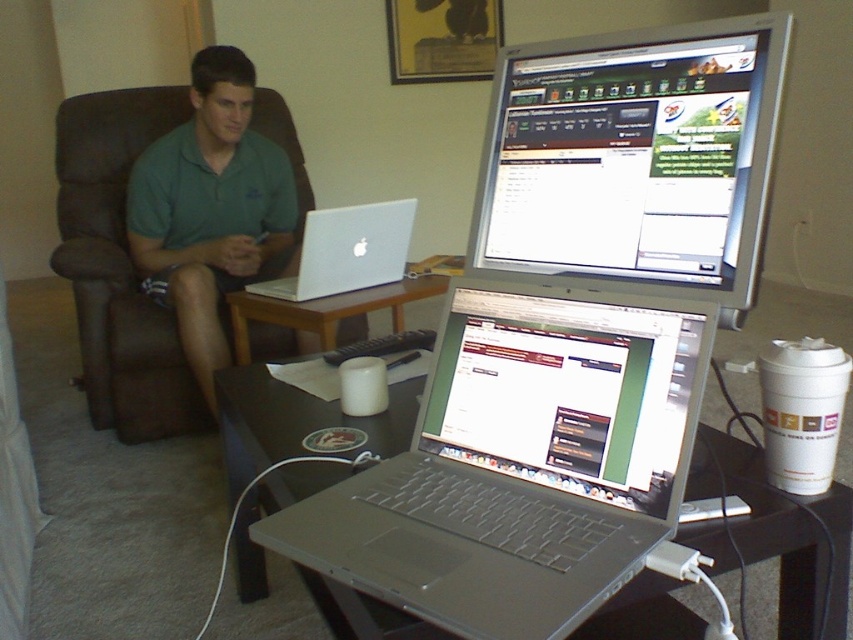
You are a delivery person who needs to place a package on the black glossy table at lower center. However, there is a green cotton polo shirt at upper left in the way. Can you place the package on the table without moving the shirt?

The black glossy table at lower center is not as tall as the green cotton polo shirt at upper left, meaning the table is shorter. Since the table is shorter than the shirt, the shirt might be hanging over the edge or placed above it, potentially blocking access. To safely place the package, you may need to adjust the shirt or ensure there is enough space around the table.

You are a delivery person who needs to place a small package on the table between the green cotton polo shirt at upper left and the silver metallic laptop at center. Can you fit the package in that space?

The distance between the green cotton polo shirt at upper left and the silver metallic laptop at center is 16.13 inches, so the package can be placed there if it is smaller than or equal to that width.

You are a delivery robot with a package that needs to be placed on the wooden table at center. The package is 16 inches wide. Can you safely place the package on the table without it overlapping the green cotton polo shirt at upper left?

The distance between the green cotton polo shirt at upper left and the wooden table at center is 16.34 inches. Since the package is 16 inches wide, it can be placed on the wooden table at center without overlapping the green cotton polo shirt at upper left as there is enough space.